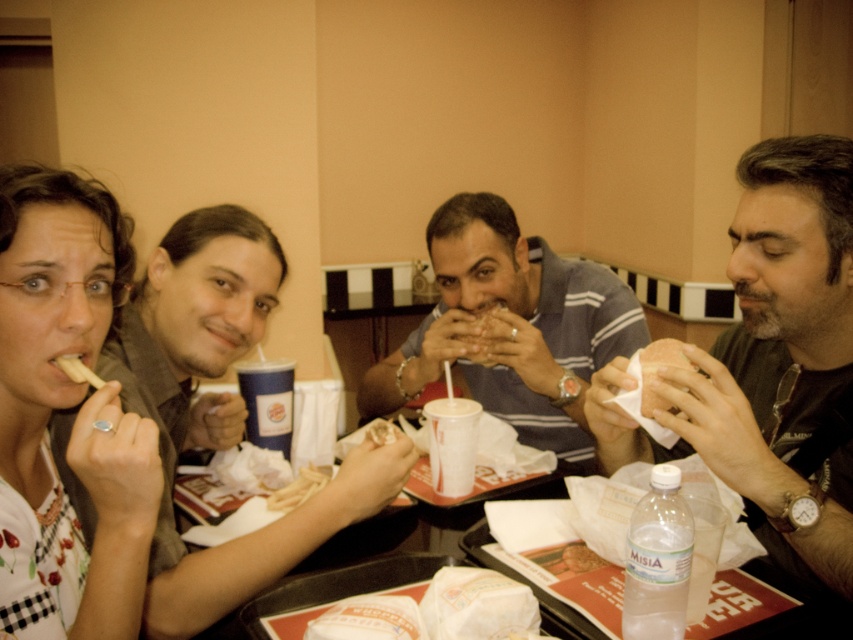
Question: Which of the following is the farthest from the observer?

Choices:
 (A) white matte french fries at lower left
 (B) smooth brown shirt at left
 (C) fried golden french fries at center
 (D) dark gray shirt at right

Answer: (C)

Question: Can you confirm if smooth brown shirt at left is positioned below matte floral shirt at left?

Choices:
 (A) yes
 (B) no

Answer: (A)

Question: Can you confirm if white paper burger at center is bigger than white matte bread at center?

Choices:
 (A) no
 (B) yes

Answer: (A)

Question: Among these points, which one is nearest to the camera?

Choices:
 (A) (733, 390)
 (B) (511, 611)
 (C) (492, 289)

Answer: (B)

Question: Which point is farther from the camera taking this photo?

Choices:
 (A) (502, 612)
 (B) (296, 483)

Answer: (B)

Question: Is striped cotton shirt at center bigger than matte plastic french fries at center?

Choices:
 (A) yes
 (B) no

Answer: (A)